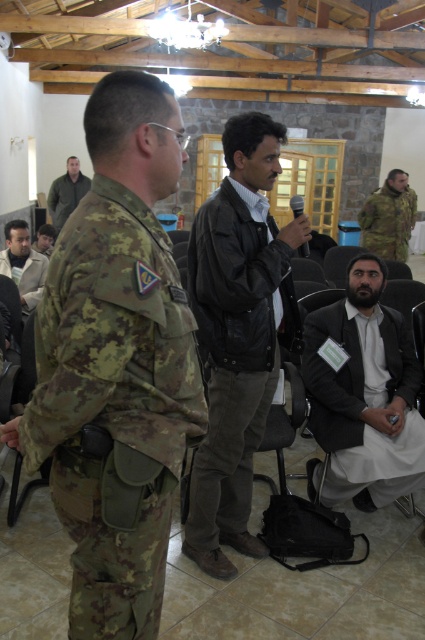
You are standing in the conference room and want to hand a document to the person closest to you. Which individual should you approach between the camouflage fabric uniform at center and the matte black jacket at center?

You should approach the camouflage fabric uniform at center because it is closer to you than the matte black jacket at center.

You are a photographer standing in the conference room and want to take a photo of both the camouflage fabric uniform at center and the matte black jacket at center. What is the minimum distance you need to move back to ensure both subjects are in frame?

The camouflage fabric uniform at center and matte black jacket at center are 3.56 meters apart from each other. To capture both in the frame, the photographer needs to move back at least 3.56 meters to ensure the entire distance between them is within the camera lens view.